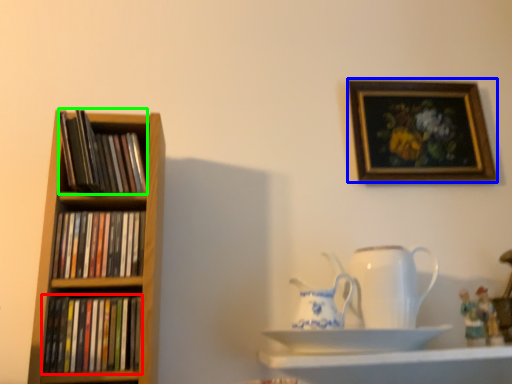
Question: Based on their relative distances, which object is nearer to book (highlighted by a red box)? Choose from picture frame (highlighted by a blue box) and book (highlighted by a green box).

Choices:
 (A) picture frame
 (B) book

Answer: (B)